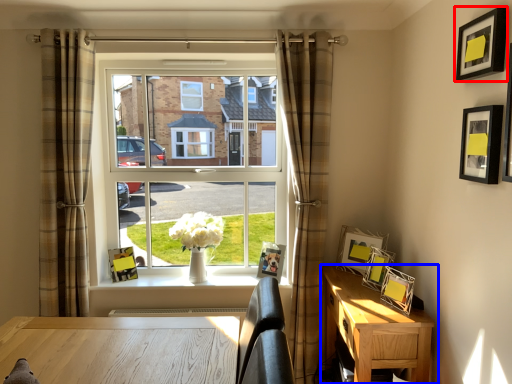
Question: Which of the following is the farthest to the observer, picture frame (highlighted by a red box) or nightstand (highlighted by a blue box)?

Choices:
 (A) picture frame
 (B) nightstand

Answer: (B)